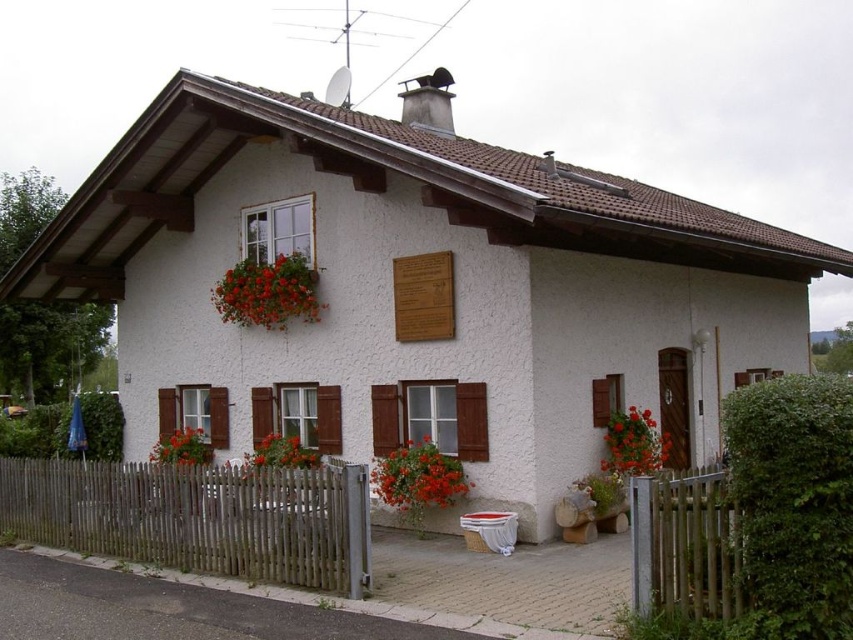
Question: Which object is farther from the camera taking this photo?

Choices:
 (A) floral fabric basket at upper left
 (B) vivid red petals at center
 (C) white fabric flower box at lower center
 (D) bright red flowers at lower left

Answer: (D)

Question: Does wooden picket fence at lower right come in front of vivid red petals at center?

Choices:
 (A) no
 (B) yes

Answer: (B)

Question: Which point is closer to the camera?

Choices:
 (A) vibrant red petals at center
 (B) bright orange flowers at lower right

Answer: (A)

Question: Which object is the farthest from the vivid red petals at center?

Choices:
 (A) brown wooden fence at lower left
 (B) vibrant red petals at center
 (C) bright red flowers at lower left
 (D) white fabric flower box at lower center

Answer: (D)

Question: Can you confirm if vibrant red petals at center is positioned to the left of bright red flowers at lower left?

Choices:
 (A) no
 (B) yes

Answer: (A)

Question: Is brown wooden fence at lower left smaller than bright orange flowers at lower right?

Choices:
 (A) no
 (B) yes

Answer: (B)